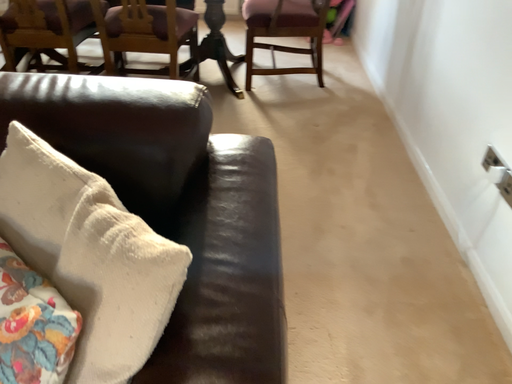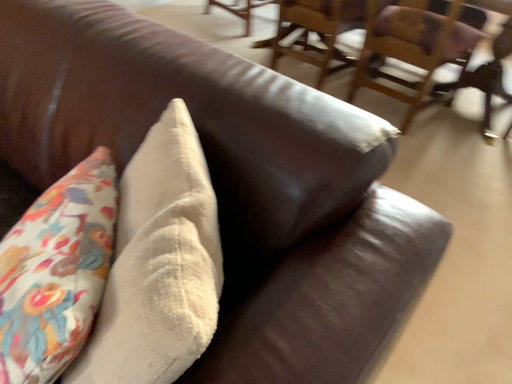
Question: Which way did the camera rotate in the video?

Choices:
 (A) rotated right
 (B) rotated left

Answer: (B)